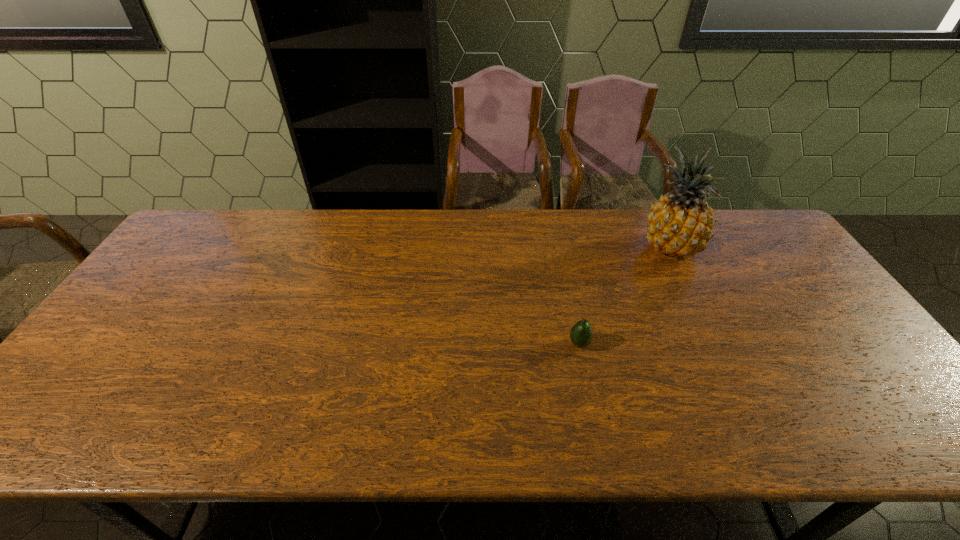
The height and width of the screenshot is (540, 960). I want to click on vacant space that satisfies the following two spatial constraints: 1. on the back side of the farther object; 2. on the right side of the nearer object, so click(560, 248).